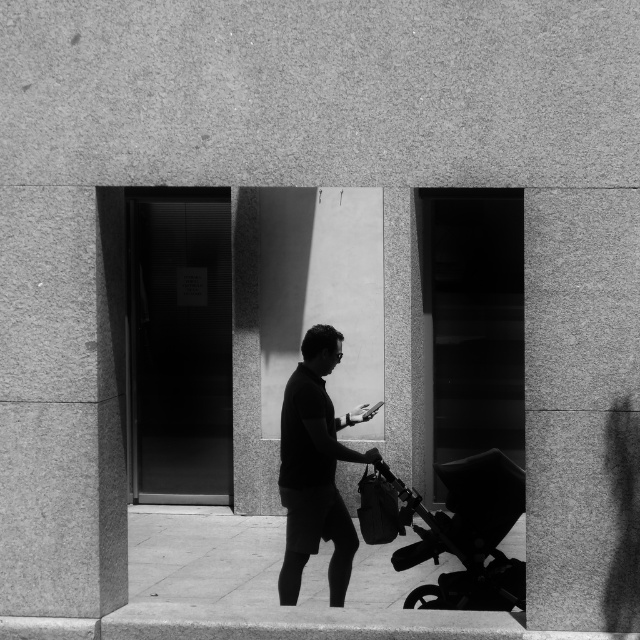
Where is `smooth concrete pavement at center`? This screenshot has width=640, height=640. smooth concrete pavement at center is located at coordinates (272, 588).

Is smooth concrete pavement at center wider than dark gray fabric shirt at center?

Correct, the width of smooth concrete pavement at center exceeds that of dark gray fabric shirt at center.

Between point (394, 621) and point (323, 394), which one is positioned behind?

Point (323, 394)

What are the coordinates of `smooth concrete pavement at center` in the screenshot? It's located at (272, 588).

Can you confirm if dark gray fabric shirt at center is positioned to the right of black plastic baby carriage at lower right?

Incorrect, dark gray fabric shirt at center is not on the right side of black plastic baby carriage at lower right.

Does point (289, 532) come closer to viewer compared to point (428, 536)?

No.

At what (x,y) coordinates should I click in order to perform the action: click on dark gray fabric shirt at center. Please return your answer as a coordinate pair (x, y). Image resolution: width=640 pixels, height=640 pixels. Looking at the image, I should click on pyautogui.click(x=316, y=468).

Is smooth concrete pavement at center taller than black plastic baby carriage at lower right?

No.

At what (x,y) coordinates should I click in order to perform the action: click on smooth concrete pavement at center. Please return your answer as a coordinate pair (x, y). This screenshot has height=640, width=640. Looking at the image, I should click on (272, 588).

Which is behind, point (141, 563) or point (484, 458)?

The point (141, 563) is more distant.

Locate an element on the screen. smooth concrete pavement at center is located at coordinates (272, 588).